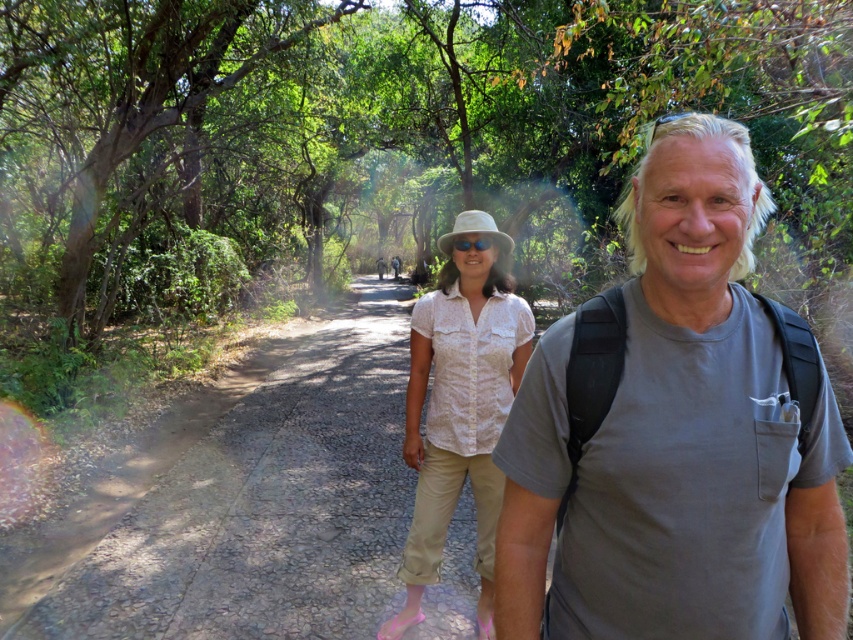
Question: Where is green leafy tree at center located in relation to white lace blouse at center in the image?

Choices:
 (A) right
 (B) left

Answer: (B)

Question: Which object is the closest to the green leafy tree at center?

Choices:
 (A) white lace blouse at center
 (B) gray cotton t-shirt at center

Answer: (B)

Question: Observing the image, what is the correct spatial positioning of dirt road at center in reference to white lace blouse at center?

Choices:
 (A) above
 (B) below

Answer: (B)

Question: Does green leafy tree at center appear under gray cotton t-shirt at center?

Choices:
 (A) yes
 (B) no

Answer: (B)

Question: Which of these objects is positioned farthest from the white lace blouse at center?

Choices:
 (A) gray cotton t-shirt at center
 (B) dirt road at center
 (C) green leafy tree at center

Answer: (C)

Question: Estimate the real-world distances between objects in this image. Which object is closer to the green leafy tree at center?

Choices:
 (A) white lace blouse at center
 (B) gray cotton t-shirt at center
 (C) dirt road at center

Answer: (C)